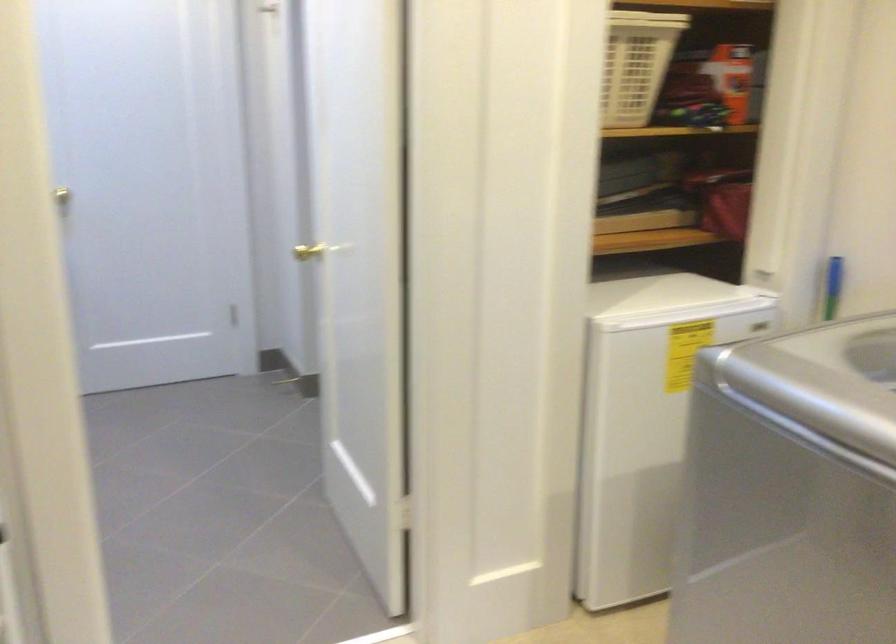
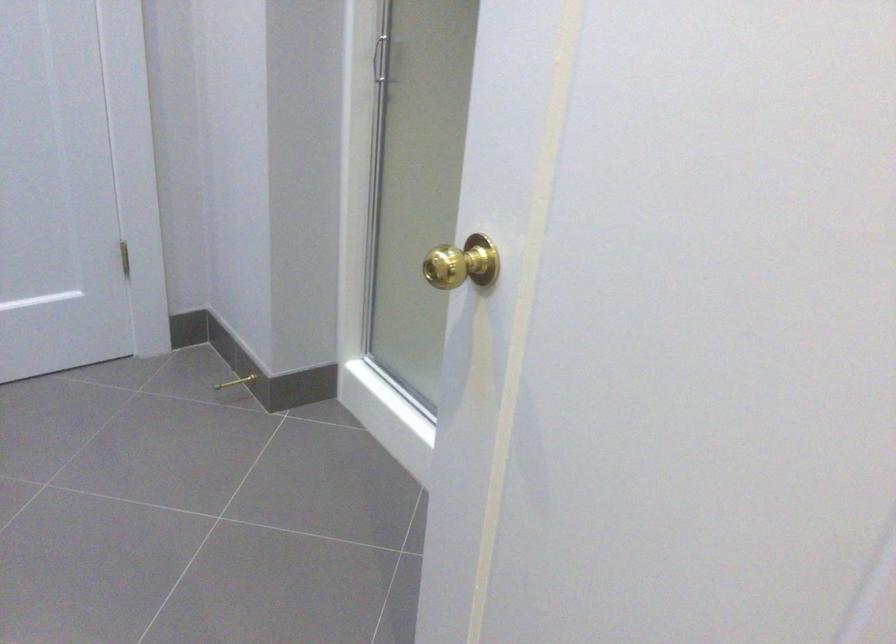
Which direction would the cameraman need to move to produce the second image?

The cameraman walked toward left, forward.